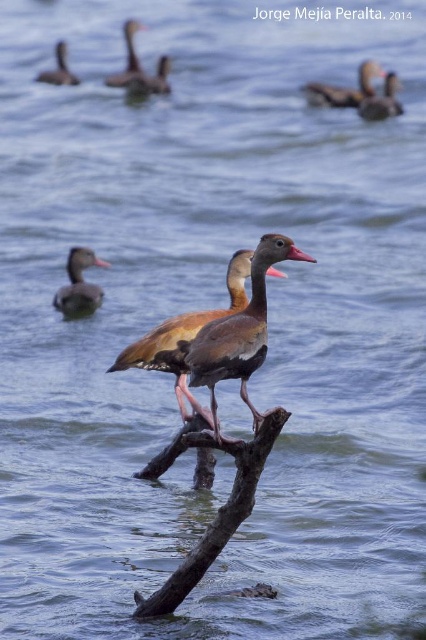
Question: Can you confirm if brown feathered duck at upper right is thinner than matte black duck at upper left?

Choices:
 (A) no
 (B) yes

Answer: (B)

Question: Is matte brown duck at upper right to the right of brown matte duck at upper center from the viewer's perspective?

Choices:
 (A) yes
 (B) no

Answer: (A)

Question: Which of the following is the closest to the observer?

Choices:
 (A) brown matte duck at center
 (B) brown matte duck at upper center
 (C) brown feathered duck at upper center
 (D) matte brown duck at center

Answer: (A)

Question: Which point is closer to the camera taking this photo?

Choices:
 (A) (152, 83)
 (B) (198, 566)
 (C) (203, 358)
 (D) (313, 81)

Answer: (C)

Question: Is matte brown duck at center further to camera compared to matte brown duck at upper right?

Choices:
 (A) yes
 (B) no

Answer: (B)

Question: Which of the following is the farthest from the observer?

Choices:
 (A) (313, 90)
 (B) (71, 296)
 (C) (184, 592)
 (D) (121, 83)

Answer: (D)